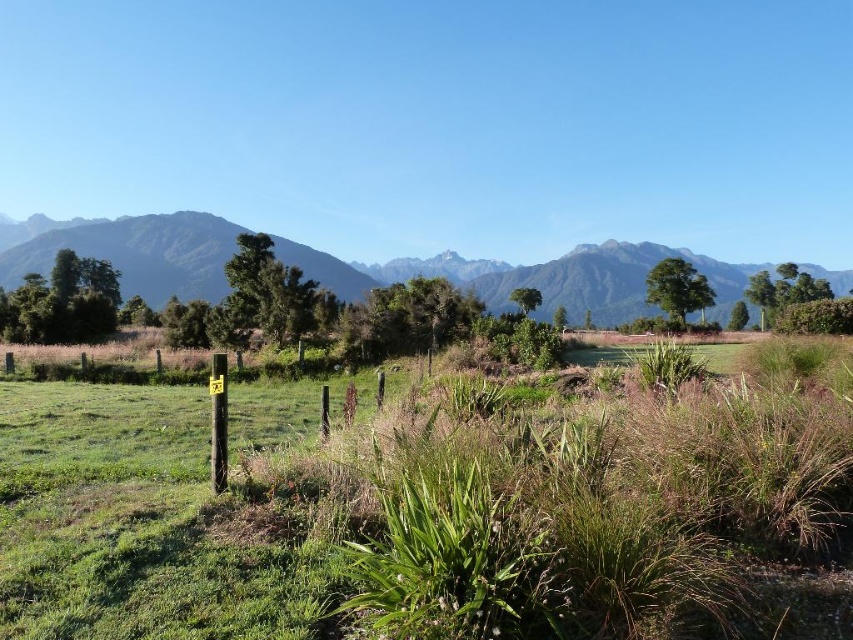
Question: Which of the following is the closest to the observer?

Choices:
 (A) green grassy at center
 (B) green grassy field at upper center

Answer: (A)

Question: Which point is closer to the camera?

Choices:
 (A) green grassy at center
 (B) green grassy field at upper center

Answer: (A)

Question: Does green grassy at center have a larger size compared to green grassy field at upper center?

Choices:
 (A) no
 (B) yes

Answer: (A)

Question: Does green grassy at center have a smaller size compared to green grassy field at upper center?

Choices:
 (A) no
 (B) yes

Answer: (B)

Question: Which object is closer to the camera taking this photo?

Choices:
 (A) green grassy field at upper center
 (B) green grassy at center

Answer: (B)

Question: Does green grassy at center appear on the right side of green grassy field at upper center?

Choices:
 (A) no
 (B) yes

Answer: (B)